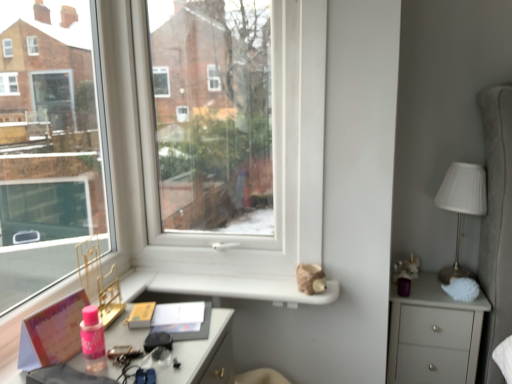
Question: Should I look upward or downward to see white ribbed fabric at right?

Choices:
 (A) down
 (B) up

Answer: (A)

Question: Considering the relative sizes of pink matte book at lower left and white ribbed fabric at right in the image provided, is pink matte book at lower left bigger than white ribbed fabric at right?

Choices:
 (A) no
 (B) yes

Answer: (A)

Question: Could you tell me if pink matte book at lower left is facing white ribbed fabric at right?

Choices:
 (A) yes
 (B) no

Answer: (B)

Question: Is pink matte book at lower left oriented away from white ribbed fabric at right?

Choices:
 (A) yes
 (B) no

Answer: (B)

Question: Is pink matte book at lower left smaller than white ribbed fabric at right?

Choices:
 (A) no
 (B) yes

Answer: (B)

Question: Can white ribbed fabric at right be found inside pink matte book at lower left?

Choices:
 (A) yes
 (B) no

Answer: (B)

Question: From the image's perspective, is pink matte book at lower left located above white ribbed fabric at right?

Choices:
 (A) yes
 (B) no

Answer: (B)

Question: Can you confirm if pink matte book at lower left is positioned to the left of transparent glass window at center?

Choices:
 (A) yes
 (B) no

Answer: (A)

Question: Considering the relative positions of pink matte book at lower left and transparent glass window at center in the image provided, is pink matte book at lower left in front of transparent glass window at center?

Choices:
 (A) yes
 (B) no

Answer: (A)

Question: Is pink matte book at lower left bigger than transparent glass window at center?

Choices:
 (A) no
 (B) yes

Answer: (A)

Question: Could you tell me if pink matte book at lower left is turned towards transparent glass window at center?

Choices:
 (A) no
 (B) yes

Answer: (A)

Question: Does pink matte book at lower left contain transparent glass window at center?

Choices:
 (A) no
 (B) yes

Answer: (A)

Question: Is pink matte book at lower left outside of transparent glass window at center?

Choices:
 (A) yes
 (B) no

Answer: (A)

Question: Considering the relative positions of matte gray chest of drawers at right and transparent glass window at center in the image provided, is matte gray chest of drawers at right in front of transparent glass window at center?

Choices:
 (A) no
 (B) yes

Answer: (A)